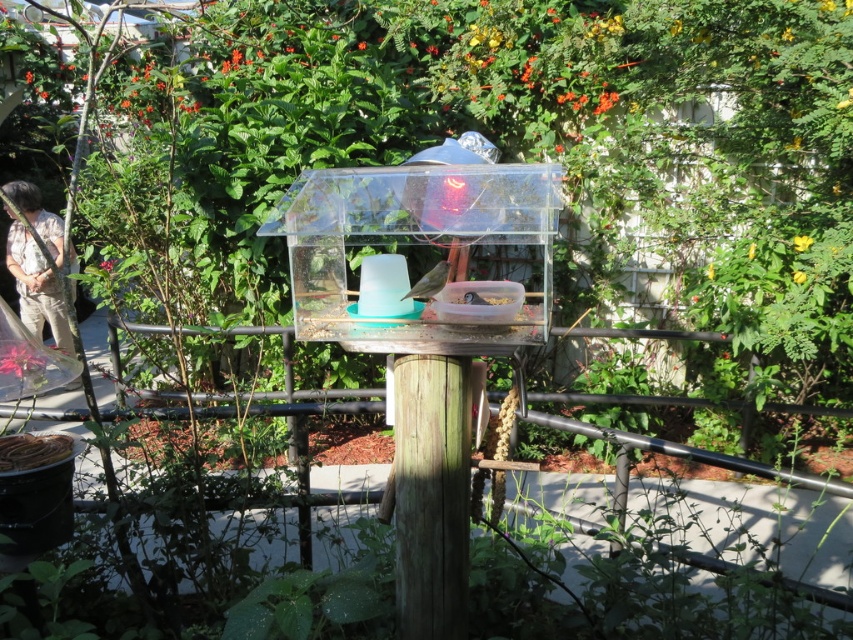
You are standing in the garden looking at the bird feeder. There are two points marked in the image. The first point is at coordinate point (375, 330) and the second point is at coordinate point (38, 259). Which point is closer to you?

Point (375, 330) is in front of point (38, 259), so it is closer to you.

You are a small bird with a wingspan of 5 inches. You want to land on the smooth gray bird at center to rest. Can you safely land on it without touching the transparent plastic bird feeder at center?

The transparent plastic bird feeder at center and smooth gray bird at center are 6.17 inches apart. Since your wingspan is 5 inches, you can safely land on the smooth gray bird at center without touching the feeder.